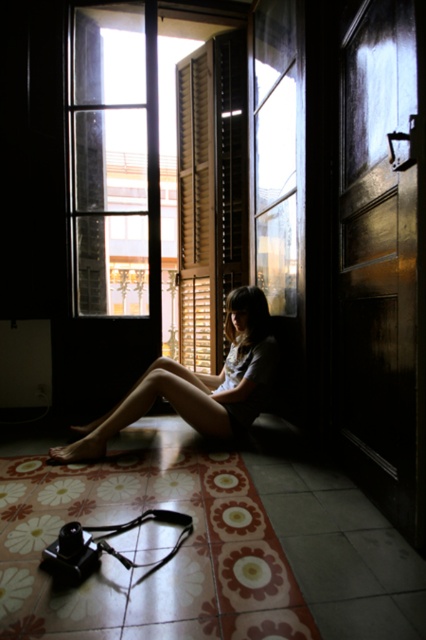
Question: Is matte skin girl at center smaller than wooden at center?

Choices:
 (A) yes
 (B) no

Answer: (B)

Question: From the image, what is the correct spatial relationship of matte skin girl at center in relation to wooden at center?

Choices:
 (A) above
 (B) below

Answer: (B)

Question: Which point is closer to the camera?

Choices:
 (A) (189, 99)
 (B) (267, 332)

Answer: (B)

Question: Can you confirm if matte skin girl at center is positioned to the right of wooden at center?

Choices:
 (A) yes
 (B) no

Answer: (B)